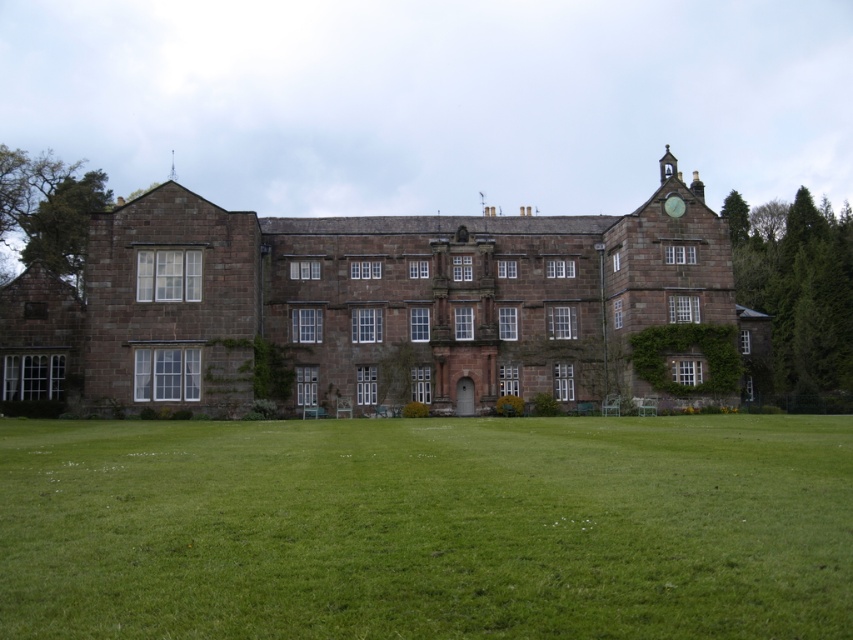
Is green grass at lower center bigger than brown stone mansion at center?

Actually, green grass at lower center might be smaller than brown stone mansion at center.

Which of these two, green grass at lower center or brown stone mansion at center, stands shorter?

green grass at lower center

Is point (76, 435) behind point (4, 365)?

No, it is in front of (4, 365).

The image size is (853, 640). Identify the location of green grass at lower center. (427, 528).